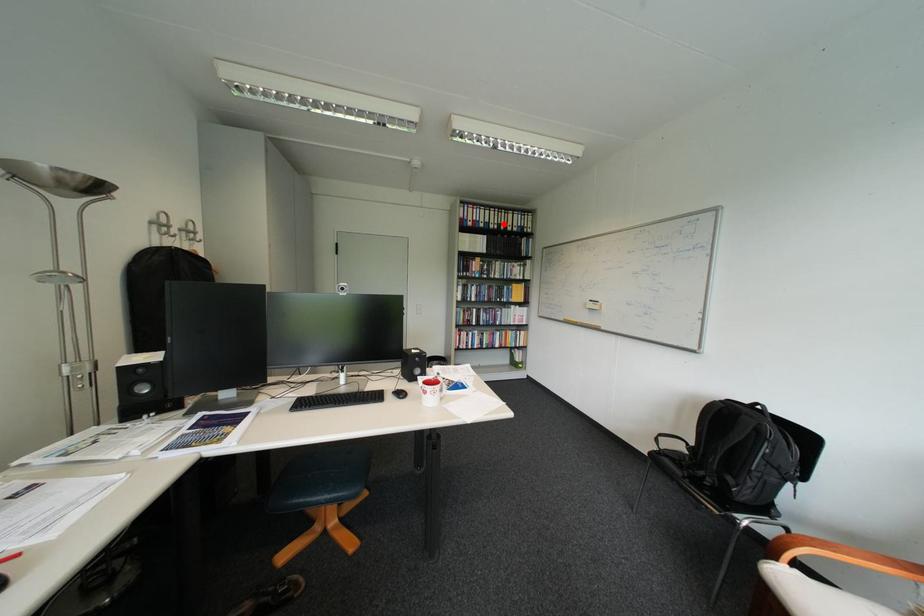
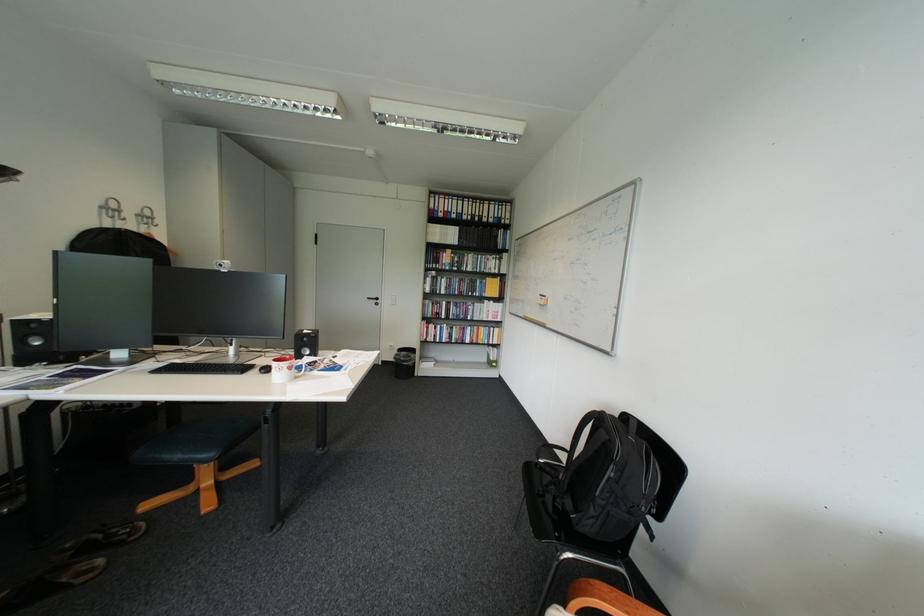
In the second image, find the point that corresponds to the highlighted location in the first image.

(477, 215)